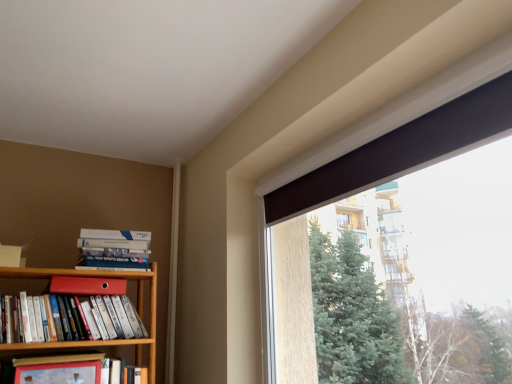
Question: From the image's perspective, is hardcover book at left, which is the 1th book in bottom-to-top order, below matte red bookshelf at left, which ranks as the second book in bottom-to-top order?

Choices:
 (A) no
 (B) yes

Answer: (B)

Question: Is hardcover book at left, which is counted as the third book, starting from the top, facing towards matte red bookshelf at left, which ranks as the second book in bottom-to-top order?

Choices:
 (A) no
 (B) yes

Answer: (A)

Question: Is hardcover book at left, which is counted as the third book, starting from the top, bigger than matte red bookshelf at left, which ranks as the second book in bottom-to-top order?

Choices:
 (A) no
 (B) yes

Answer: (A)

Question: From a real-world perspective, is hardcover book at left, which is the 1th book in bottom-to-top order, beneath matte red bookshelf at left, which ranks as the second book in bottom-to-top order?

Choices:
 (A) yes
 (B) no

Answer: (A)

Question: Is hardcover book at left, which is the 1th book in bottom-to-top order, positioned beyond the bounds of matte red bookshelf at left, which ranks as the second book in bottom-to-top order?

Choices:
 (A) no
 (B) yes

Answer: (B)

Question: Is hardcover book at left, which is the 1th book in bottom-to-top order, not near matte red bookshelf at left, positioned as the second book in top-to-bottom order?

Choices:
 (A) no
 (B) yes

Answer: (A)

Question: Does hardcover book at left, the 1th paperback book positioned from the front, have a greater width compared to hardcover books at left, marked as the 1th book in a top-to-bottom arrangement?

Choices:
 (A) yes
 (B) no

Answer: (B)

Question: Would you say hardcover books at left, marked as the 1th book in a top-to-bottom arrangement, is part of hardcover book at left, the 1th paperback book positioned from the front,'s contents?

Choices:
 (A) yes
 (B) no

Answer: (B)

Question: Does hardcover book at left, positioned as the 1th paperback book in bottom-to-top order, have a lesser width compared to hardcover books at left, marked as the 1th book in a top-to-bottom arrangement?

Choices:
 (A) no
 (B) yes

Answer: (B)

Question: From a real-world perspective, is hardcover book at left, which is the second paperback book from top to bottom, over hardcover books at left, marked as the 1th book in a top-to-bottom arrangement?

Choices:
 (A) yes
 (B) no

Answer: (B)

Question: Does hardcover book at left, the 1th paperback book positioned from the front, appear on the right side of hardcover books at left, the 3th book positioned from the bottom?

Choices:
 (A) no
 (B) yes

Answer: (A)

Question: Is hardcover book at left, which is the second paperback book from top to bottom, facing towards hardcover books at left, the 3th book positioned from the bottom?

Choices:
 (A) yes
 (B) no

Answer: (B)

Question: Does hardcover book at left, which is counted as the third book, starting from the top, appear on the right side of hardcover books at left, marked as the 1th book in a top-to-bottom arrangement?

Choices:
 (A) no
 (B) yes

Answer: (B)